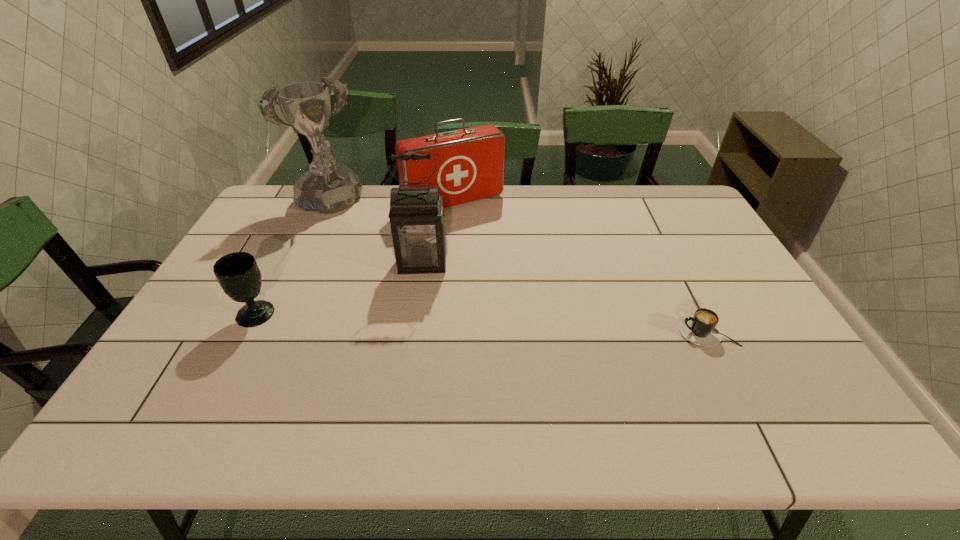
This screenshot has height=540, width=960. I want to click on vacant space at the far right corner of the desktop, so click(x=649, y=188).

The image size is (960, 540). What are the coordinates of `vacant area between the rightmost object and the third tallest object` in the screenshot? It's located at click(x=581, y=267).

You are a GUI agent. You are given a task and a screenshot of the screen. Output one action in this format:
    pyautogui.click(x=<x>, y=<y>)
    Task: Click on the empty space that is in between the lantern and the chalice
    
    Given the screenshot: What is the action you would take?
    pyautogui.click(x=340, y=288)

Find the location of a particular element. The width and height of the screenshot is (960, 540). free space between the award and the second shortest object is located at coordinates (292, 260).

Where is `free space between the second shortest object and the shortest object`? free space between the second shortest object and the shortest object is located at coordinates (482, 323).

I want to click on vacant space that is in between the rightmost object and the second tallest object, so click(564, 298).

At what (x,y) coordinates should I click in order to perform the action: click on free space that is in between the third tallest object and the rightmost object. Please return your answer as a coordinate pair (x, y). Image resolution: width=960 pixels, height=540 pixels. Looking at the image, I should click on (581, 267).

Locate an element on the screen. The image size is (960, 540). free space between the first-aid kit and the cappuccino is located at coordinates (581, 267).

Where is `vacant area between the cappuccino and the lantern`? The image size is (960, 540). vacant area between the cappuccino and the lantern is located at coordinates (564, 298).

At what (x,y) coordinates should I click in order to perform the action: click on unoccupied position between the chalice and the lantern. Please return your answer as a coordinate pair (x, y). Image resolution: width=960 pixels, height=540 pixels. Looking at the image, I should click on (340, 288).